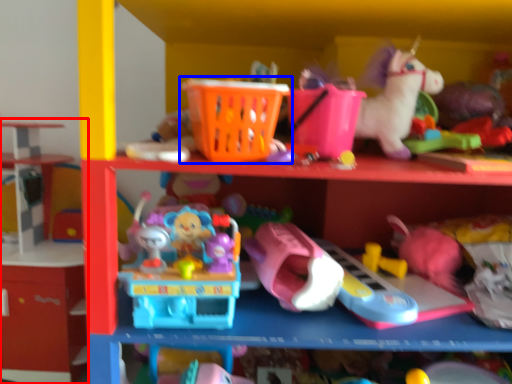
Question: Among these objects, which one is nearest to the camera, shelf (highlighted by a red box) or toy (highlighted by a blue box)?

Choices:
 (A) shelf
 (B) toy

Answer: (B)